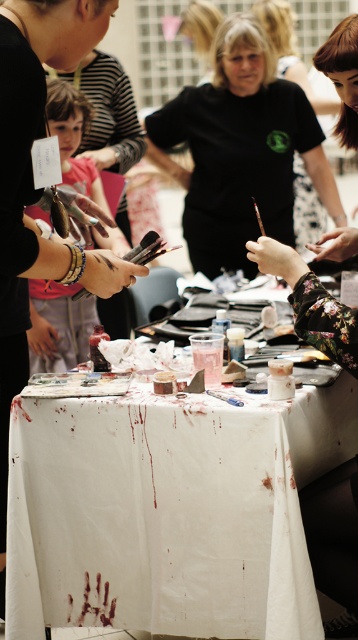
Question: Is white cloth at center positioned at the back of black matte t-shirt at center?

Choices:
 (A) yes
 (B) no

Answer: (B)

Question: Can you confirm if white cloth at center is positioned to the left of black matte t-shirt at center?

Choices:
 (A) yes
 (B) no

Answer: (A)

Question: Does white cloth at center appear on the left side of black matte t-shirt at center?

Choices:
 (A) no
 (B) yes

Answer: (B)

Question: Which of the following is the closest to the observer?

Choices:
 (A) (269, 608)
 (B) (35, 198)

Answer: (B)

Question: Which object appears farthest from the camera in this image?

Choices:
 (A) black matte t-shirt at center
 (B) white cloth at center
 (C) matte black shirt at center

Answer: (A)

Question: Which object is the farthest from the white cloth at center?

Choices:
 (A) black matte t-shirt at center
 (B) matte black shirt at center

Answer: (A)